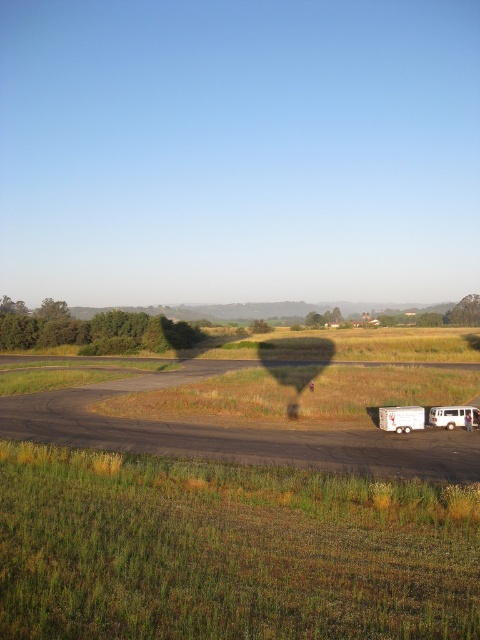
Is brown dirt track at center closer to camera compared to white metallic bus at center-right?

That is True.

Does brown dirt track at center have a lesser height compared to white metallic bus at center-right?

Incorrect, brown dirt track at center's height does not fall short of white metallic bus at center-right's.

Who is more forward, (154,374) or (464,417)?

Point (464,417) is more forward.

Identify the location of brown dirt track at center. (232, 433).

Which is above, white matte trailer truck at lower right or white metallic bus at center-right?

white matte trailer truck at lower right

Between point (384, 426) and point (436, 410), which one is positioned behind?

The point (436, 410) is more distant.

Who is more distant from viewer, (394, 422) or (453, 428)?

Point (453, 428)

You are a GUI agent. You are given a task and a screenshot of the screen. Output one action in this format:
    pyautogui.click(x=<x>, y=<y>)
    Task: Click on the white matte trailer truck at lower right
    This screenshot has width=480, height=640.
    Given the screenshot: What is the action you would take?
    pos(402,419)

Between brown dirt track at center and white matte trailer truck at lower right, which one is positioned lower?

brown dirt track at center is lower down.

Between brown dirt track at center and white matte trailer truck at lower right, which one appears on the left side from the viewer's perspective?

brown dirt track at center is more to the left.

Which is behind, point (405, 435) or point (406, 410)?

The point (406, 410) is behind.

Image resolution: width=480 pixels, height=640 pixels. Identify the location of brown dirt track at center. (232, 433).